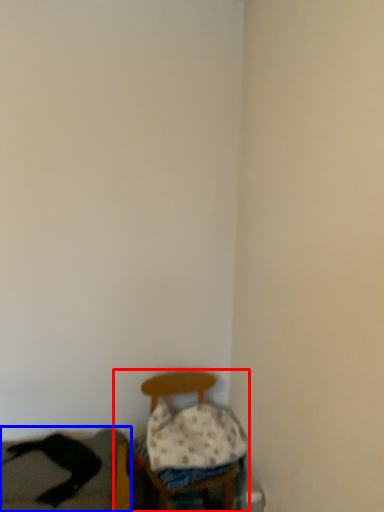
Question: Which object appears closest to the camera in this image, furniture (highlighted by a red box) or couch (highlighted by a blue box)?

Choices:
 (A) furniture
 (B) couch

Answer: (B)